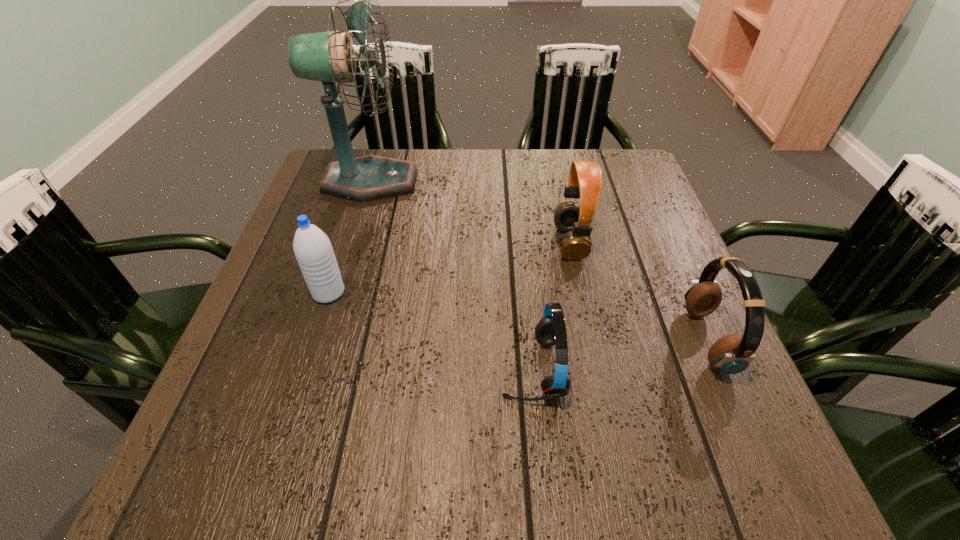
Where is `free space between the farthest object and the water bottle`? The width and height of the screenshot is (960, 540). free space between the farthest object and the water bottle is located at coordinates (349, 237).

Locate which object ranks second in proximity to the water bottle. Please provide its 2D coordinates. Your answer should be formatted as a tuple, i.e. [(x, y)], where the tuple contains the x and y coordinates of a point satisfying the conditions above.

[(551, 330)]

Identify the location of object that can be found as the second closest to the third object from right to left. (731, 354).

Choose which headset is the second nearest neighbor to the rightmost headset. Please provide its 2D coordinates. Your answer should be formatted as a tuple, i.e. [(x, y)], where the tuple contains the x and y coordinates of a point satisfying the conditions above.

[(551, 330)]

I want to click on the closest headset to the rightmost headset, so click(x=585, y=179).